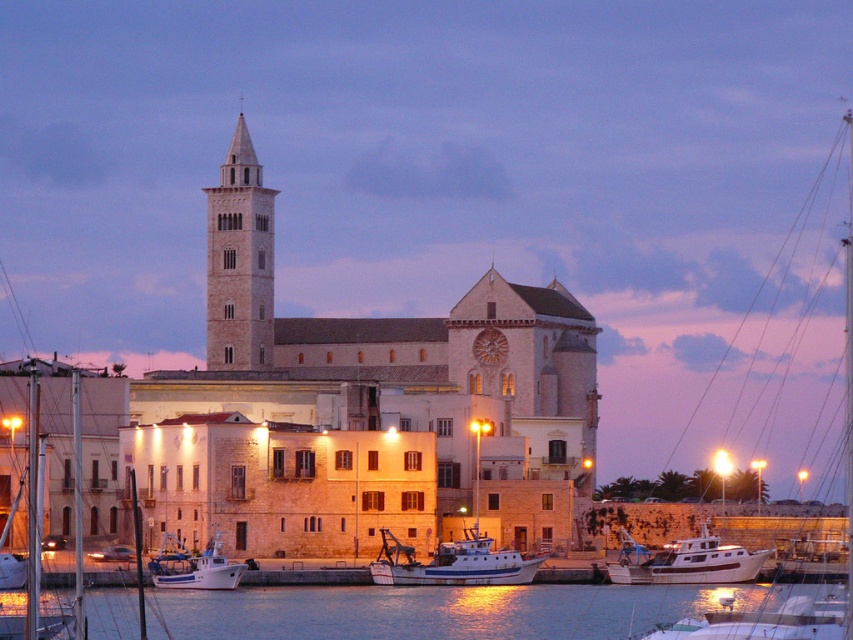
You are standing at the waterfront and want to take a photo of the light beige stone bell tower at center and the glossy water at lower center. Which object should you focus on first if you want to capture both in a single frame without moving the camera?

You should focus on the light beige stone bell tower at center first because the glossy water at lower center is located below it, allowing both to be captured in the same frame by centering the bell tower and including the water below.

You are a photographer planning to take a photo of the waterfront scene. You want to ensure both the white matte boat at center and the white matte boat at lower left are clearly visible in the frame. Based on their positions, which boat should you position closer to the front of the image to avoid one blocking the other?

You should position the white matte boat at center closer to the front of the image because the white matte boat at lower left is behind it, ensuring both are visible without obstruction.

You are a photographer planning to capture the waterfront scene. You have two white matte boats in view. Which boat, the white matte boat at center or the white matte boat at lower left, would appear bigger in your photo?

The white matte boat at center appears bigger in the photo because it has a larger size compared to the white matte boat at lower left.